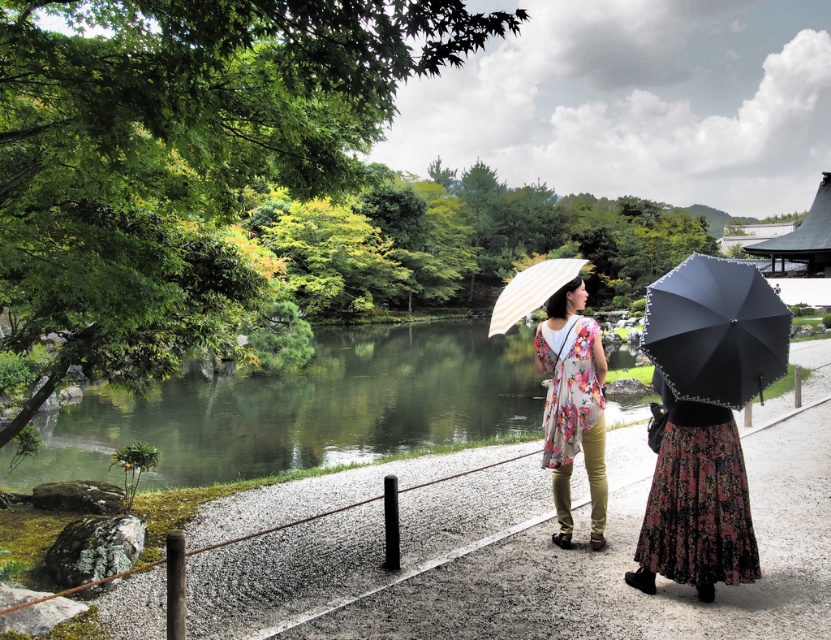
Does green smooth water at center have a smaller size compared to floral-patterned skirt at center?

No, green smooth water at center is not smaller than floral-patterned skirt at center.

Measure the distance between green smooth water at center and floral-patterned skirt at center.

green smooth water at center is 44.99 feet from floral-patterned skirt at center.

Does point (360, 403) come closer to viewer compared to point (724, 419)?

That is False.

Locate an element on the screen. This screenshot has width=831, height=640. green smooth water at center is located at coordinates (303, 408).

Is floral-patterned skirt at center shorter than matte black umbrella at right?

In fact, floral-patterned skirt at center may be taller than matte black umbrella at right.

Does floral-patterned skirt at center come in front of matte black umbrella at right?

That is False.

Does point (731, 465) lie behind point (736, 330)?

That is True.

The height and width of the screenshot is (640, 831). What are the coordinates of `floral-patterned skirt at center` in the screenshot? It's located at (696, 502).

Between point (766, 333) and point (557, 280), which one is positioned in front?

Point (766, 333)

Looking at this image, which is below, matte black umbrella at right or white striped fabric umbrella at center?

Positioned lower is matte black umbrella at right.

Which is behind, point (677, 289) or point (515, 292)?

Point (515, 292)

Locate an element on the screen. The image size is (831, 640). matte black umbrella at right is located at coordinates (715, 330).